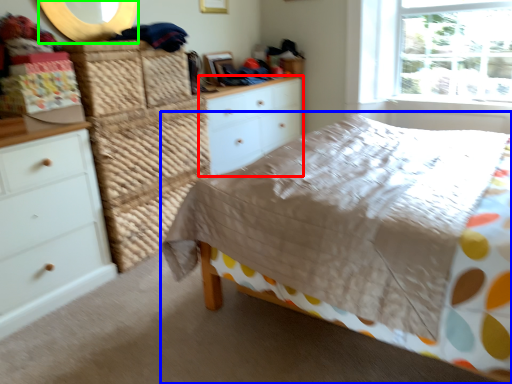
Question: Considering the real-world distances, which object is farthest from chest of drawers (highlighted by a red box)? bed (highlighted by a blue box) or mirror (highlighted by a green box)?

Choices:
 (A) bed
 (B) mirror

Answer: (A)